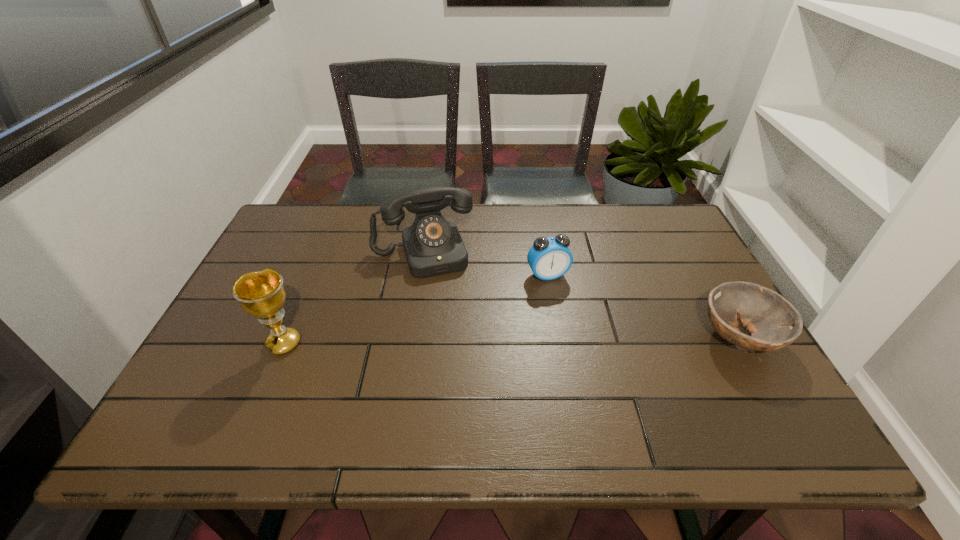
Where is `free spot on the desktop that is between the chalice and the rightmost object and is positioned on the dial of the second object from left to right`? free spot on the desktop that is between the chalice and the rightmost object and is positioned on the dial of the second object from left to right is located at coordinates (448, 341).

You are a GUI agent. You are given a task and a screenshot of the screen. Output one action in this format:
    pyautogui.click(x=<x>, y=<y>)
    Task: Click on the free spot on the desktop that is between the chalice and the rightmost object and is positioned on the face of the second object from right to left
    
    Given the screenshot: What is the action you would take?
    pyautogui.click(x=582, y=339)